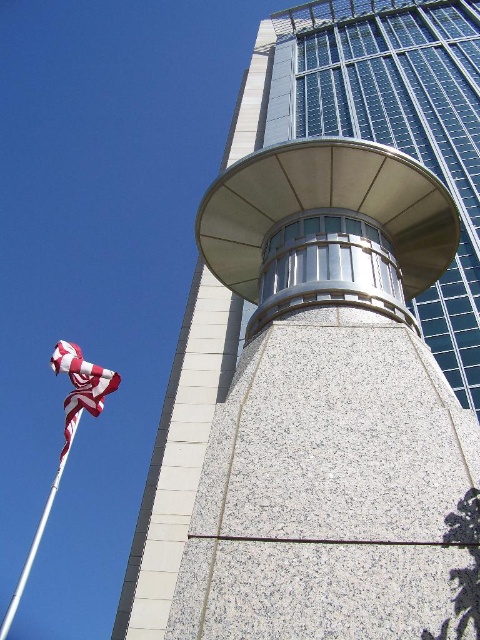
Question: Which point appears farthest from the camera in this image?

Choices:
 (A) (99, 394)
 (B) (72, 435)

Answer: (A)

Question: Observing the image, what is the correct spatial positioning of striped fabric flag at left in reference to white glossy flag pole at lower left?

Choices:
 (A) left
 (B) right

Answer: (B)

Question: Can you confirm if striped fabric flag at left is positioned below white glossy flag pole at lower left?

Choices:
 (A) yes
 (B) no

Answer: (B)

Question: Which of the following is the farthest from the observer?

Choices:
 (A) (10, 605)
 (B) (78, 378)

Answer: (A)

Question: Which of the following is the closest to the observer?

Choices:
 (A) white glossy flag pole at lower left
 (B) striped fabric flag at left

Answer: (B)

Question: Is striped fabric flag at left to the right of white glossy flag pole at lower left from the viewer's perspective?

Choices:
 (A) yes
 (B) no

Answer: (A)